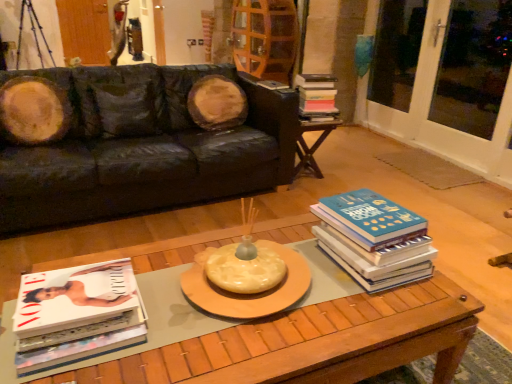
Question: From the image's perspective, is white glass screen door at right, arranged as the 2th screen door when viewed from the left, over black leather couch at upper left?

Choices:
 (A) no
 (B) yes

Answer: (B)

Question: Does white glass screen door at right, acting as the 2th screen door starting from the top, have a lesser width compared to black leather couch at upper left?

Choices:
 (A) no
 (B) yes

Answer: (B)

Question: Is white glass screen door at right, the first screen door in the front-to-back sequence, located outside black leather couch at upper left?

Choices:
 (A) no
 (B) yes

Answer: (B)

Question: Could you tell me if white glass screen door at right, the first screen door in the front-to-back sequence, is facing black leather couch at upper left?

Choices:
 (A) yes
 (B) no

Answer: (A)

Question: Is white glass screen door at right, the first screen door when ordered from right to left, facing away from black leather couch at upper left?

Choices:
 (A) yes
 (B) no

Answer: (B)

Question: Is black leather couch at upper left taller or shorter than wooden coffee table at center?

Choices:
 (A) short
 (B) tall

Answer: (B)

Question: Considering the relative positions of black leather couch at upper left and wooden coffee table at center in the image provided, is black leather couch at upper left to the left or to the right of wooden coffee table at center?

Choices:
 (A) left
 (B) right

Answer: (A)

Question: From the image's perspective, is black leather couch at upper left positioned above or below wooden coffee table at center?

Choices:
 (A) above
 (B) below

Answer: (A)

Question: Does point (278, 92) appear closer or farther from the camera than point (316, 296)?

Choices:
 (A) farther
 (B) closer

Answer: (A)

Question: Considering the positions of point (308, 89) and point (147, 158), is point (308, 89) closer or farther from the camera than point (147, 158)?

Choices:
 (A) farther
 (B) closer

Answer: (A)

Question: In the image, is hardcover book at center, which is the first book from top to bottom, on the left side or the right side of black leather couch at upper left?

Choices:
 (A) left
 (B) right

Answer: (B)

Question: From the image's perspective, relative to black leather couch at upper left, is hardcover book at center, which ranks as the third book in bottom-to-top order, above or below?

Choices:
 (A) below
 (B) above

Answer: (B)

Question: Which is correct: hardcover book at center, acting as the third book starting from the left, is inside black leather couch at upper left, or outside of it?

Choices:
 (A) inside
 (B) outside

Answer: (B)

Question: Based on their sizes in the image, would you say wooden coffee table at center is bigger or smaller than white glass screen door at right, the first screen door in the front-to-back sequence?

Choices:
 (A) small
 (B) big

Answer: (B)

Question: Relative to white glass screen door at right, placed as the 2th screen door when sorted from back to front, is wooden coffee table at center in front or behind?

Choices:
 (A) behind
 (B) front

Answer: (B)